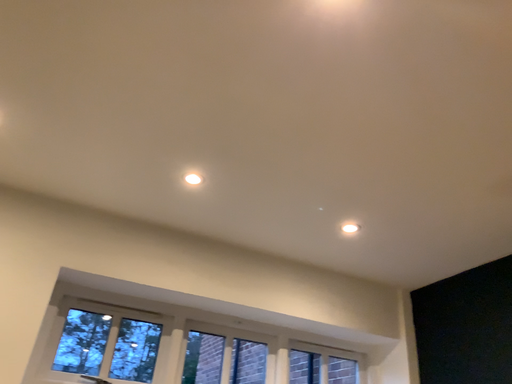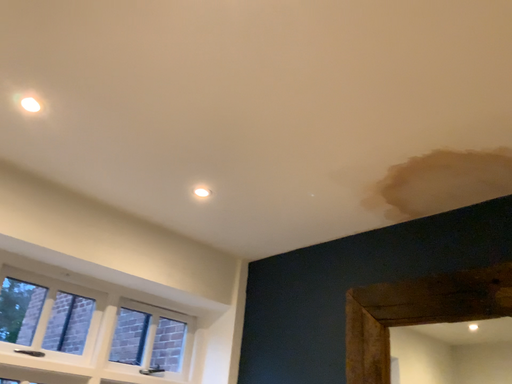
Question: Which way did the camera rotate in the video?

Choices:
 (A) rotated right
 (B) rotated left

Answer: (A)